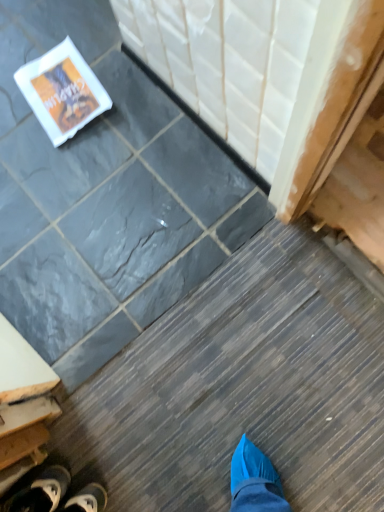
Question: Should I look upward or downward to see black canvas shoe at lower left?

Choices:
 (A) up
 (B) down

Answer: (B)